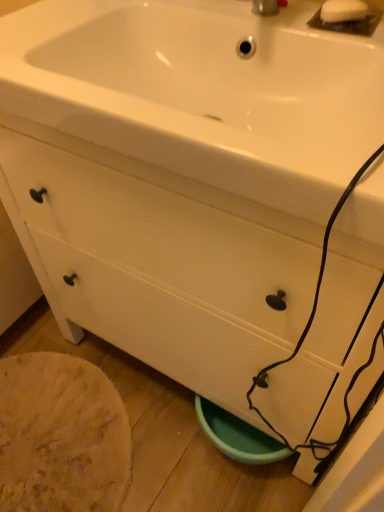
You are a GUI agent. You are given a task and a screenshot of the screen. Output one action in this format:
    pyautogui.click(x=<x>, y=<y>)
    Task: Click on the blank space above white matte drawer at lower center (from a real-world perspective)
    This screenshot has height=512, width=384.
    Given the screenshot: What is the action you would take?
    pyautogui.click(x=109, y=421)